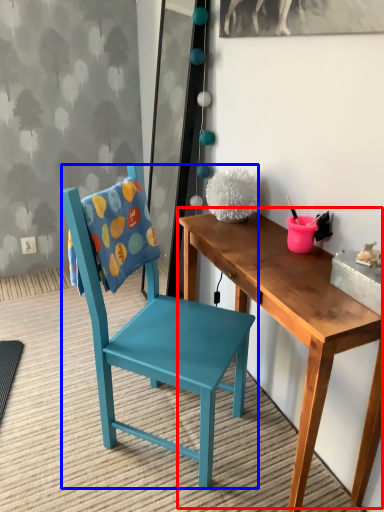
Question: Which object is further to the camera taking this photo, table (highlighted by a red box) or chair (highlighted by a blue box)?

Choices:
 (A) table
 (B) chair

Answer: (B)